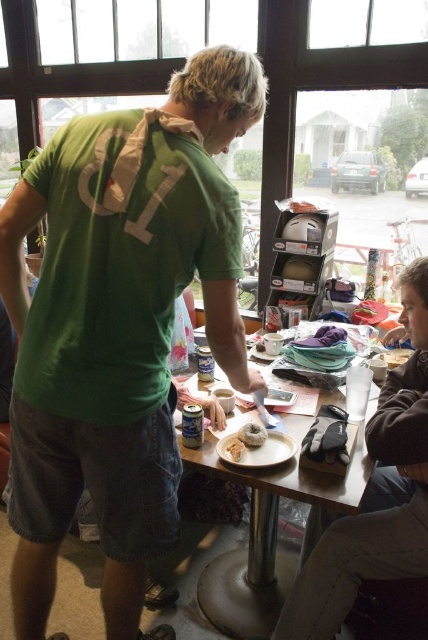
From the picture: You are a barista who needs to place a 15 inch wide tray on the table between the brown fuzzy sweater at lower right and the soft white bread at table center. Can the tray fit in that space?

The distance between the brown fuzzy sweater at lower right and the soft white bread at table center is 16.40 inches. Since the tray is 15 inches wide, it can fit in the space between them.

You are a customer at the cafe and want to place your phone on the table without it sliding off. Considering the brown fuzzy sweater at lower right and the white fluffy donut at center, which item should you place the phone next to for stability?

The brown fuzzy sweater at lower right has a greater height compared to the white fluffy donut at center, so placing the phone next to the brown fuzzy sweater at lower right would provide a more stable and elevated surface to prevent it from sliding off.